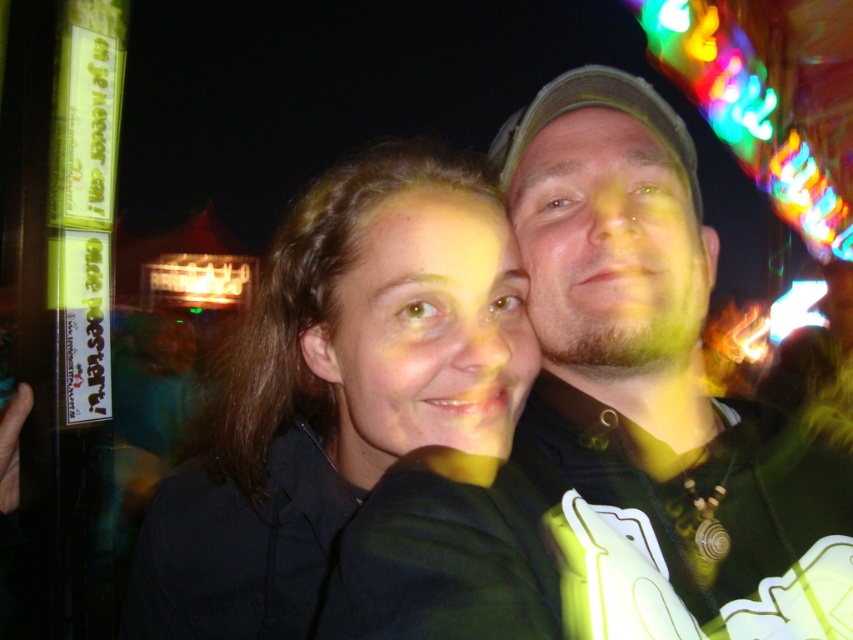
Is point (788, 518) in front of point (519, 308)?

No, it is behind (519, 308).

Which is more to the left, matte black hoodie at center or dark brown hair at center?

dark brown hair at center

Is point (540, 182) positioned behind point (199, 536)?

No, (540, 182) is closer to viewer.

Identify the location of matte black hoodie at center. (654, 388).